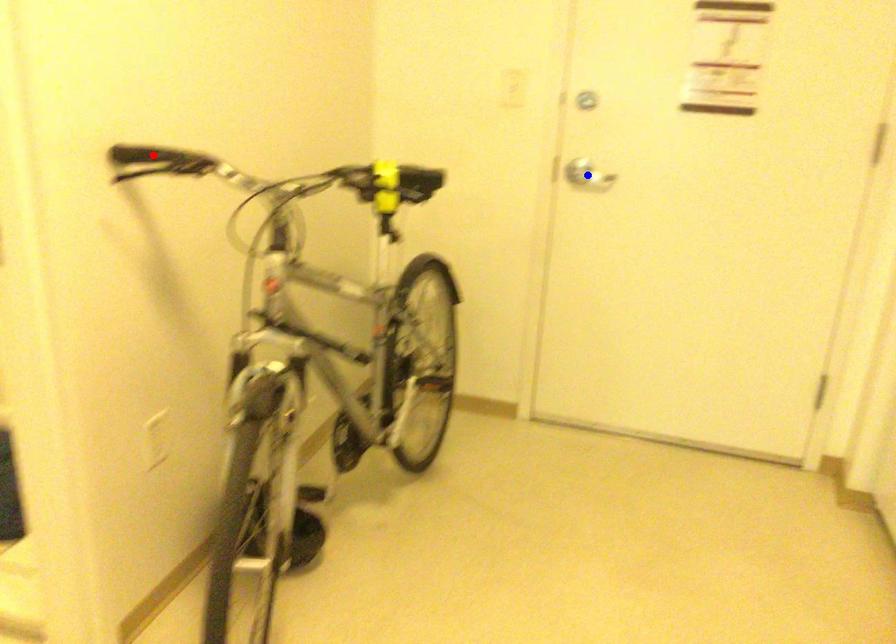
Question: Which of the two points in the image is closer to the camera?

Choices:
 (A) Blue point is closer.
 (B) Red point is closer.

Answer: (B)